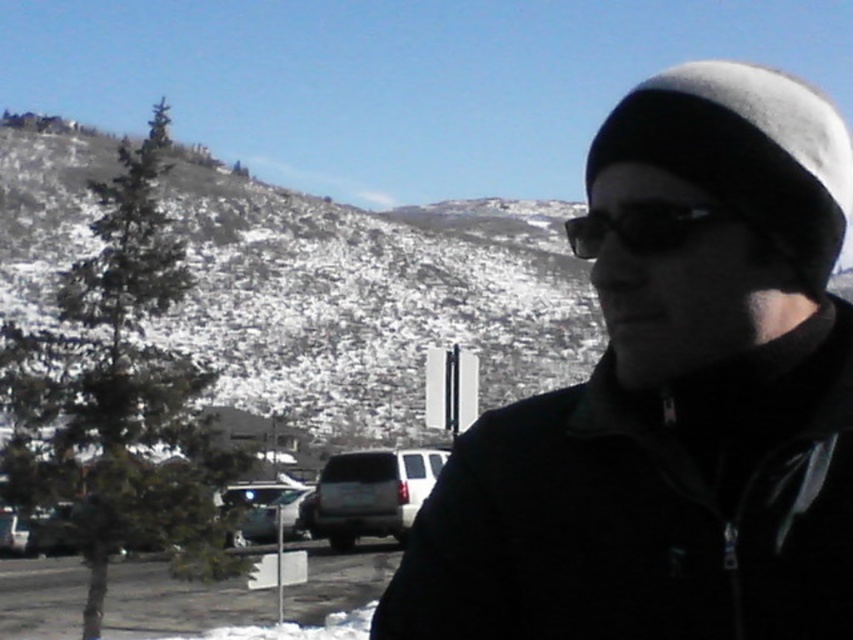
You are a photographer trying to capture a clear view of the snowy textured hillside at upper left. However, there is a metallic silver sedan at lower left in the way. Can you move the sedan to get a better shot?

The metallic silver sedan at lower left is behind the snowy textured hillside at upper left, so moving the sedan would not obstruct the view of the snowy textured hillside at upper left. However, since the sedan is already behind the hillside, it is not blocking the view and you don not need to move it.

You are a photographer standing in the snowy area. You want to take a photo of the silver metallic suv at center without the black matte jacket at center blocking the view. Is it possible to move to a position where the suv is fully visible without the jacket in the frame?

The black matte jacket at center is in front of the silver metallic suv at center, so moving to a position where the jacket is no longer blocking the suv might be possible by shifting your angle or moving around the jacket to ensure the suv is fully visible without obstruction.